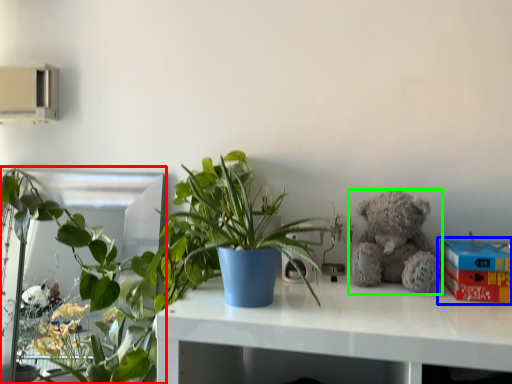
Question: Estimate the real-world distances between objects in this image. Which object is farther from houseplant (highlighted by a red box), box (highlighted by a blue box) or teddy bear (highlighted by a green box)?

Choices:
 (A) box
 (B) teddy bear

Answer: (A)